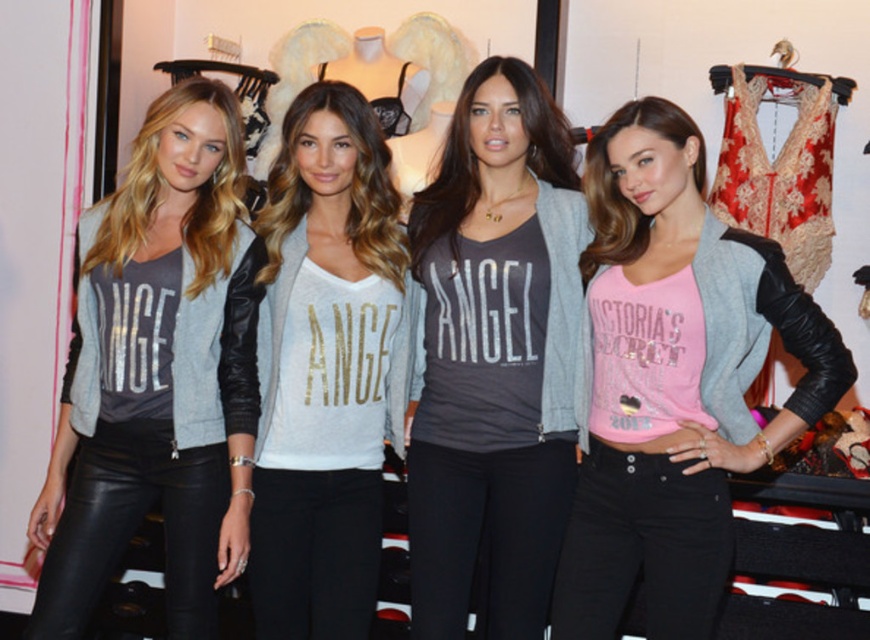
You are a store employee who needs to arrange the matte gray cardigan at center and the silver metallic shirt at center closer together for a display. The minimum distance required between items is 10 inches. Can you move them closer without violating the store policy?

The matte gray cardigan at center is currently 11.03 inches away from the silver metallic shirt at center. Since 11.03 inches is greater than the required minimum distance of 10 inches, you can move them closer while still maintaining the required spacing.

You are a customer in a clothing store and see the pink matte jersey at center and the matte gray cardigan at center. Which one can you grab first without moving your position?

The pink matte jersey at center is in front of the matte gray cardigan at center, so you can grab the pink matte jersey at center first without moving.

You are a customer in a store and you want to buy a jersey and a cardigan. You see the pink matte jersey at center and the matte gray cardigan at center. Which one is bigger in size?

The pink matte jersey at center is larger in size than the matte gray cardigan at center.